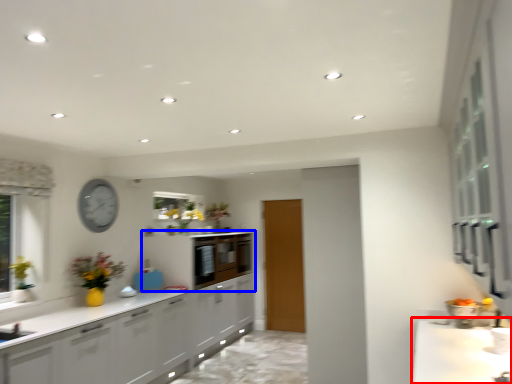
Question: Which object is further to the camera taking this photo, countertop (highlighted by a red box) or cabinetry (highlighted by a blue box)?

Choices:
 (A) countertop
 (B) cabinetry

Answer: (B)